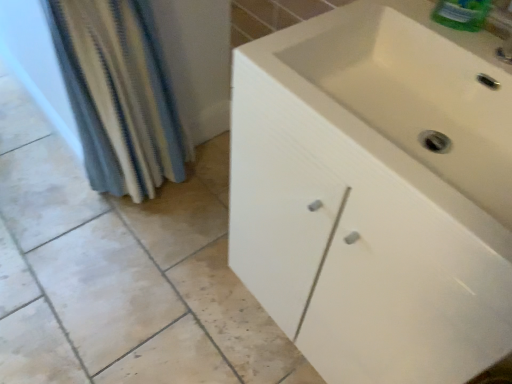
Question: From the image's perspective, relative to white matte cabinet at center, is blue striped fabric at left above or below?

Choices:
 (A) below
 (B) above

Answer: (B)

Question: Considering the positions of blue striped fabric at left and white matte cabinet at center in the image, is blue striped fabric at left bigger or smaller than white matte cabinet at center?

Choices:
 (A) small
 (B) big

Answer: (A)

Question: Which is correct: blue striped fabric at left is inside white matte cabinet at center, or outside of it?

Choices:
 (A) inside
 (B) outside

Answer: (B)

Question: From a real-world perspective, relative to blue striped fabric at left, is white matte cabinet at center vertically above or below?

Choices:
 (A) below
 (B) above

Answer: (A)

Question: Is white matte cabinet at center in front of or behind blue striped fabric at left in the image?

Choices:
 (A) behind
 (B) front

Answer: (B)

Question: Is white matte cabinet at center bigger or smaller than blue striped fabric at left?

Choices:
 (A) big
 (B) small

Answer: (A)

Question: In terms of width, does white matte cabinet at center look wider or thinner when compared to blue striped fabric at left?

Choices:
 (A) wide
 (B) thin

Answer: (A)